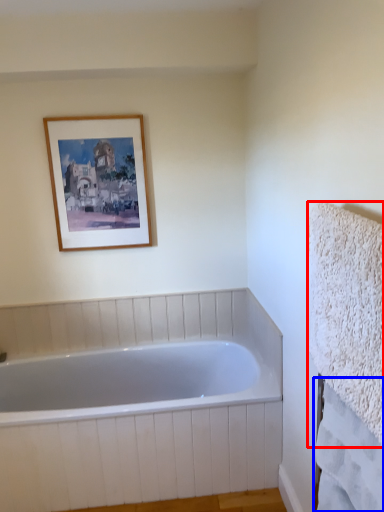
Question: Which point is further to the camera, bath towel (highlighted by a red box) or bath towel (highlighted by a blue box)?

Choices:
 (A) bath towel
 (B) bath towel

Answer: (B)